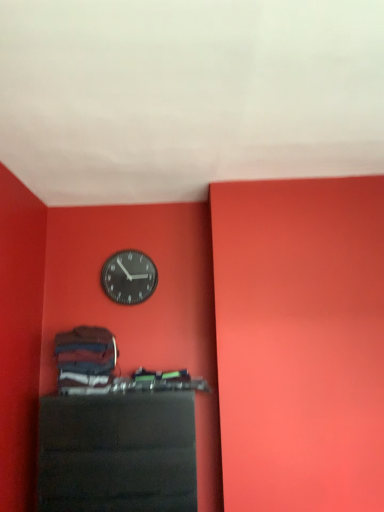
Question: Considering the positions of black glossy shelf at lower center and metallic black clock at upper center in the image, is black glossy shelf at lower center bigger or smaller than metallic black clock at upper center?

Choices:
 (A) small
 (B) big

Answer: (B)

Question: Which is correct: black glossy shelf at lower center is inside metallic black clock at upper center, or outside of it?

Choices:
 (A) outside
 (B) inside

Answer: (A)

Question: From a real-world perspective, is black glossy shelf at lower center physically located above or below metallic black clock at upper center?

Choices:
 (A) below
 (B) above

Answer: (A)

Question: Is metallic black clock at upper center in front of or behind black glossy shelf at lower center in the image?

Choices:
 (A) behind
 (B) front

Answer: (A)

Question: From a real-world perspective, is metallic black clock at upper center positioned above or below black glossy shelf at lower center?

Choices:
 (A) above
 (B) below

Answer: (A)

Question: Based on their positions, is metallic black clock at upper center located to the left or right of black glossy shelf at lower center?

Choices:
 (A) left
 (B) right

Answer: (A)

Question: Is point (107, 267) closer or farther from the camera than point (57, 414)?

Choices:
 (A) farther
 (B) closer

Answer: (A)